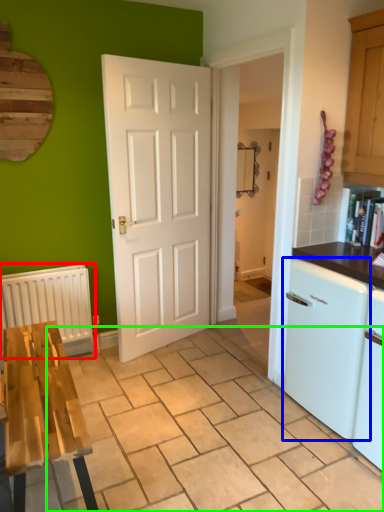
Question: Considering the real-world distances, which object is farthest from radiator (highlighted by a red box)? dish washer (highlighted by a blue box) or tile (highlighted by a green box)?

Choices:
 (A) dish washer
 (B) tile

Answer: (A)